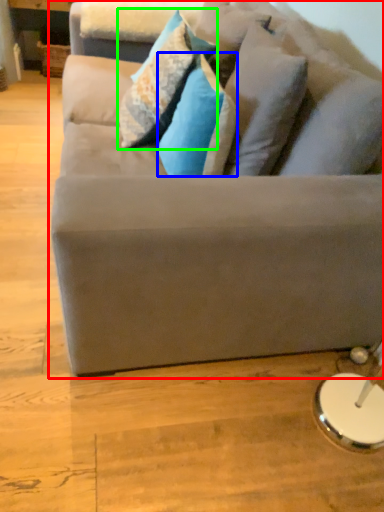
Question: Estimate the real-world distances between objects in this image. Which object is farther from studio couch (highlighted by a red box), pillow (highlighted by a blue box) or pillow (highlighted by a green box)?

Choices:
 (A) pillow
 (B) pillow

Answer: (B)